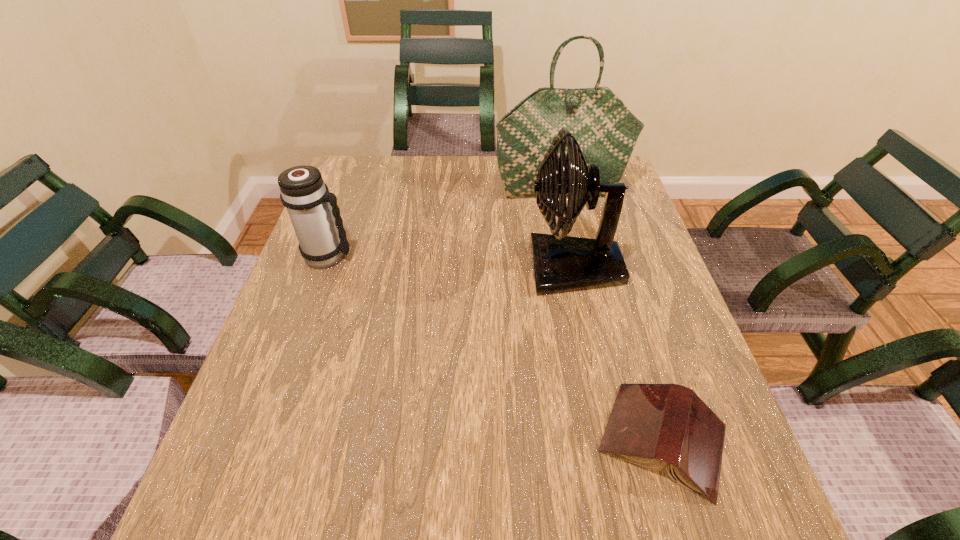
You are a GUI agent. You are given a task and a screenshot of the screen. Output one action in this format:
    pyautogui.click(x=<x>, y=<y>)
    Task: Click on the free spot between the tote bag and the leftmost object
    The height and width of the screenshot is (540, 960).
    Given the screenshot: What is the action you would take?
    pyautogui.click(x=444, y=223)

This screenshot has height=540, width=960. I want to click on empty location between the third shortest object and the leftmost object, so click(451, 262).

I want to click on empty space that is in between the nearest object and the fan, so (618, 354).

What are the coordinates of `object that is the second closest to the third shortest object` in the screenshot? It's located at (651, 425).

Locate an element on the screen. The width and height of the screenshot is (960, 540). object that is the third closest to the leftmost object is located at coordinates (651, 425).

At what (x,y) coordinates should I click in order to perform the action: click on vacant space that satisfies the following two spatial constraints: 1. on the back side of the nearest object; 2. in front of the fan to blow air. Please return your answer as a coordinate pair (x, y). The height and width of the screenshot is (540, 960). Looking at the image, I should click on (611, 268).

The height and width of the screenshot is (540, 960). What are the coordinates of `vacant space that satisfies the following two spatial constraints: 1. on the side with the handle of the book; 2. on the left side of the second shortest object` in the screenshot? It's located at (263, 439).

Find the location of a particular element. Image resolution: width=960 pixels, height=540 pixels. free spot that satisfies the following two spatial constraints: 1. on the front side of the shortest object; 2. on the left side of the tote bag is located at coordinates (617, 439).

At what (x,y) coordinates should I click in order to perform the action: click on free location that satisfies the following two spatial constraints: 1. on the side with the handle of the nearest object; 2. on the right side of the thermos bottle. Please return your answer as a coordinate pair (x, y). Looking at the image, I should click on (263, 439).

You are a GUI agent. You are given a task and a screenshot of the screen. Output one action in this format:
    pyautogui.click(x=<x>, y=<y>)
    Task: Click on the vacant space that satisfies the following two spatial constraints: 1. in front of the fan to blow air; 2. on the left side of the shortest object
    The width and height of the screenshot is (960, 540).
    Given the screenshot: What is the action you would take?
    pyautogui.click(x=611, y=439)